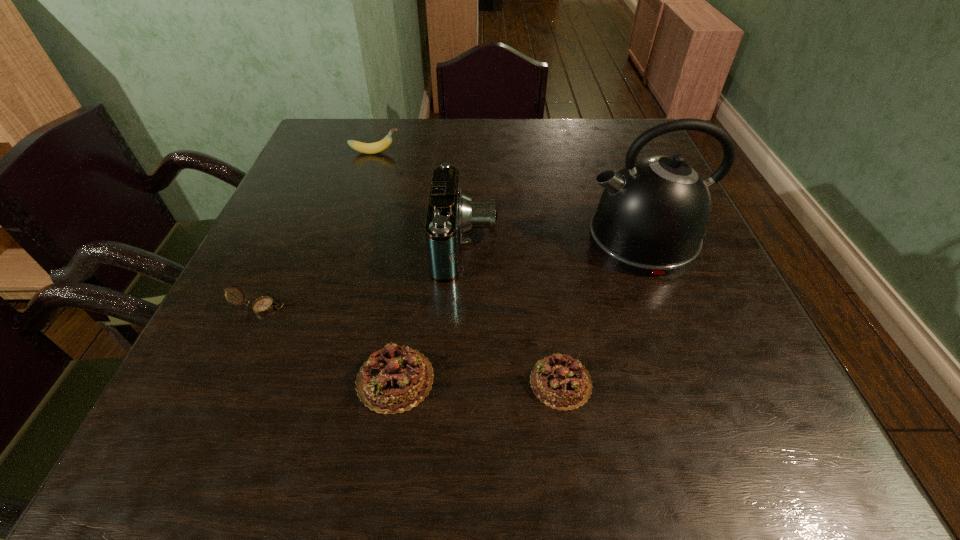
Where is `free point between the camcorder and the fifth object from left to right`? The image size is (960, 540). free point between the camcorder and the fifth object from left to right is located at coordinates (513, 313).

Identify the location of unoccupied area between the fourth shortest object and the tallest object. The height and width of the screenshot is (540, 960). (509, 196).

You are a GUI agent. You are given a task and a screenshot of the screen. Output one action in this format:
    pyautogui.click(x=<x>, y=<y>)
    Task: Click on the free space between the camcorder and the banana
    Image resolution: width=960 pixels, height=540 pixels.
    Given the screenshot: What is the action you would take?
    pyautogui.click(x=420, y=198)

This screenshot has height=540, width=960. I want to click on free point between the tallest object and the taller chocolate cake, so click(x=519, y=309).

Identify the location of vacant area that lies between the compass and the camcorder. (363, 275).

Where is `vacant space in between the tallest object and the left chocolate cake`? vacant space in between the tallest object and the left chocolate cake is located at coordinates (519, 309).

Identify the location of free space between the left chocolate cake and the rightmost object. The width and height of the screenshot is (960, 540). (519, 309).

Find the location of a particular element. Image resolution: width=960 pixels, height=540 pixels. free spot between the leftmost object and the farthest object is located at coordinates pos(318,230).

Find the location of a particular element. The width and height of the screenshot is (960, 540). vacant area that lies between the kettle and the taller chocolate cake is located at coordinates (519, 309).

This screenshot has width=960, height=540. What are the coordinates of `object that can be found as the second closest to the tallest object` in the screenshot? It's located at (559, 381).